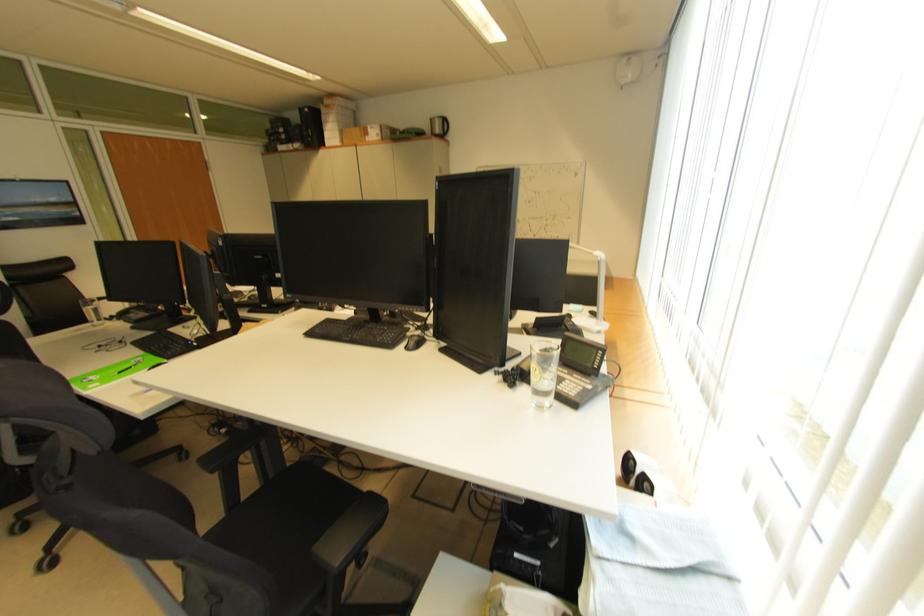
Find the location of `phone handset`. phone handset is located at coordinates click(x=524, y=369).